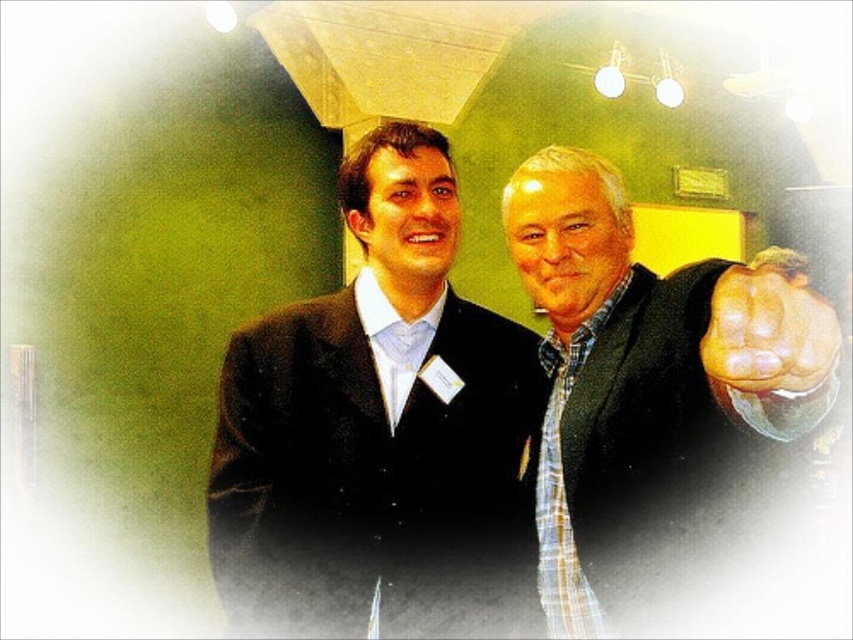
Question: Is black woolen suit at center smaller than muscular skin fist at right?

Choices:
 (A) yes
 (B) no

Answer: (B)

Question: Which object appears farthest from the camera in this image?

Choices:
 (A) black woolen suit at center
 (B) muscular skin fist at right

Answer: (A)

Question: Which of the following is the farthest from the observer?

Choices:
 (A) muscular skin fist at right
 (B) black woolen suit at center

Answer: (B)

Question: Which point is farther to the camera?

Choices:
 (A) plaid shirt at right
 (B) muscular skin fist at right

Answer: (A)

Question: Does black woolen suit at center have a lesser width compared to muscular skin fist at right?

Choices:
 (A) yes
 (B) no

Answer: (B)

Question: Does black woolen suit at center have a larger size compared to plaid shirt at right?

Choices:
 (A) no
 (B) yes

Answer: (A)